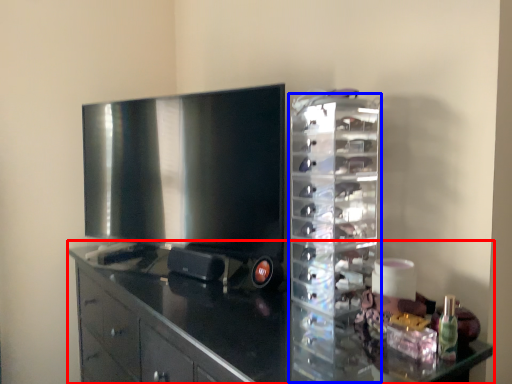
Question: Which object appears farthest to the camera in this image, cabinetry (highlighted by a red box) or glass box (highlighted by a blue box)?

Choices:
 (A) cabinetry
 (B) glass box

Answer: (B)